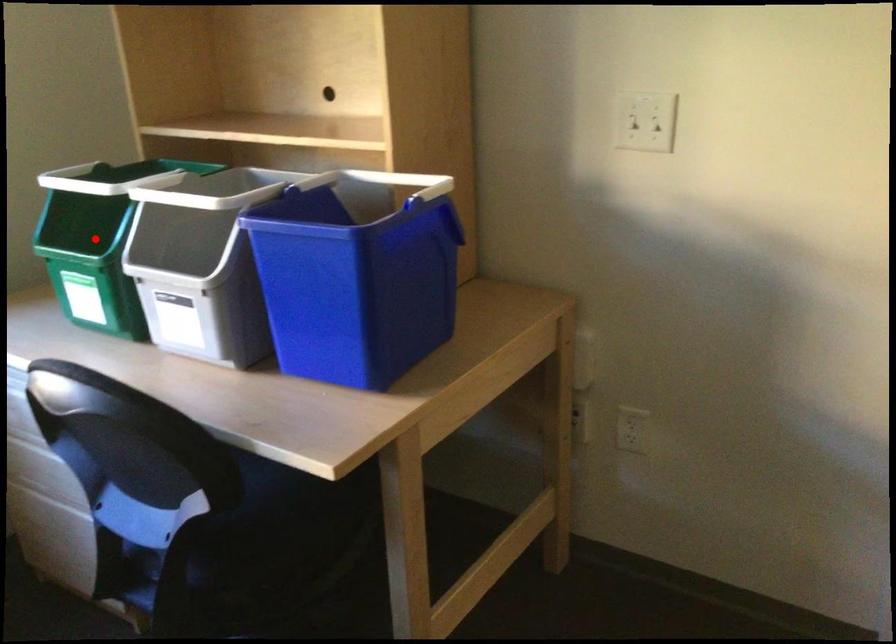
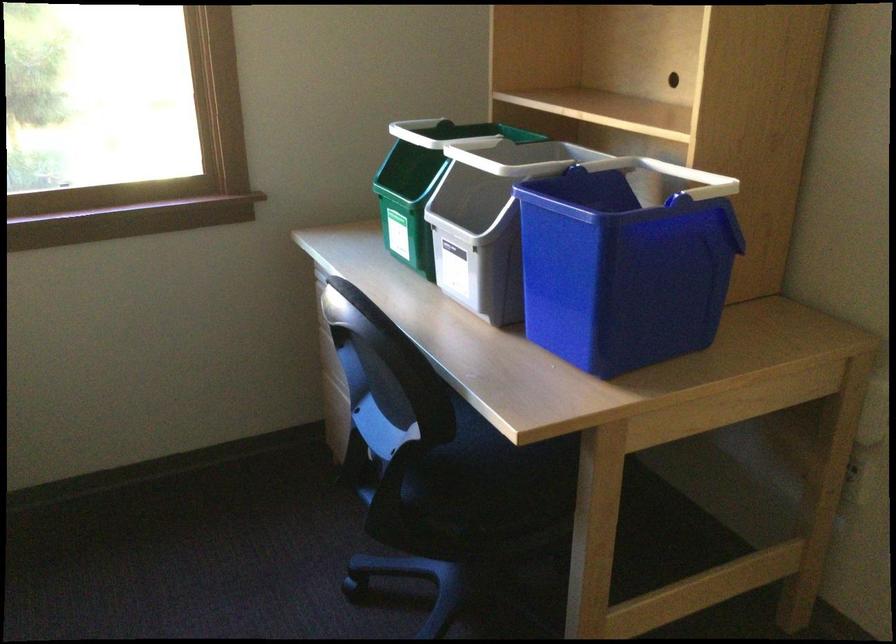
Where in the second image is the point corresponding to the highlighted location from the first image?

(421, 184)